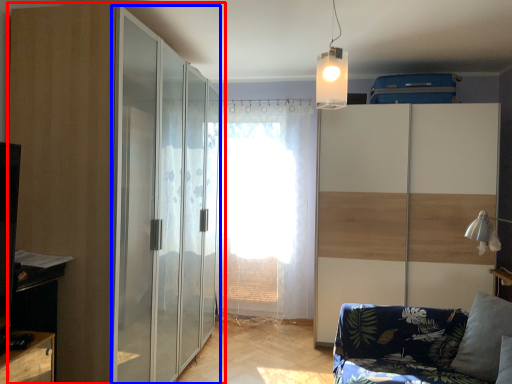
Question: Which object is further to the camera taking this photo, door (highlighted by a red box) or screen door (highlighted by a blue box)?

Choices:
 (A) door
 (B) screen door

Answer: (B)